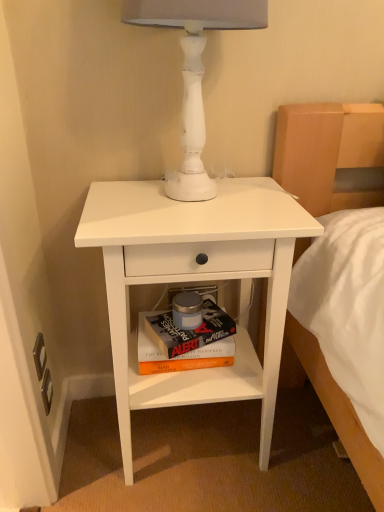
Locate an element on the screen. The image size is (384, 512). vacant region under white matte table lamp at upper center (from a real-world perspective) is located at coordinates (185, 200).